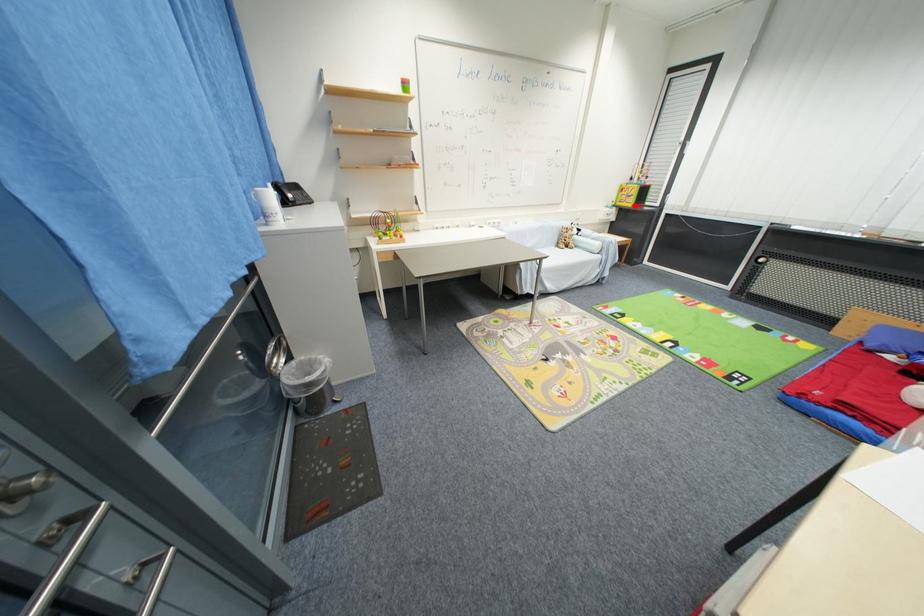
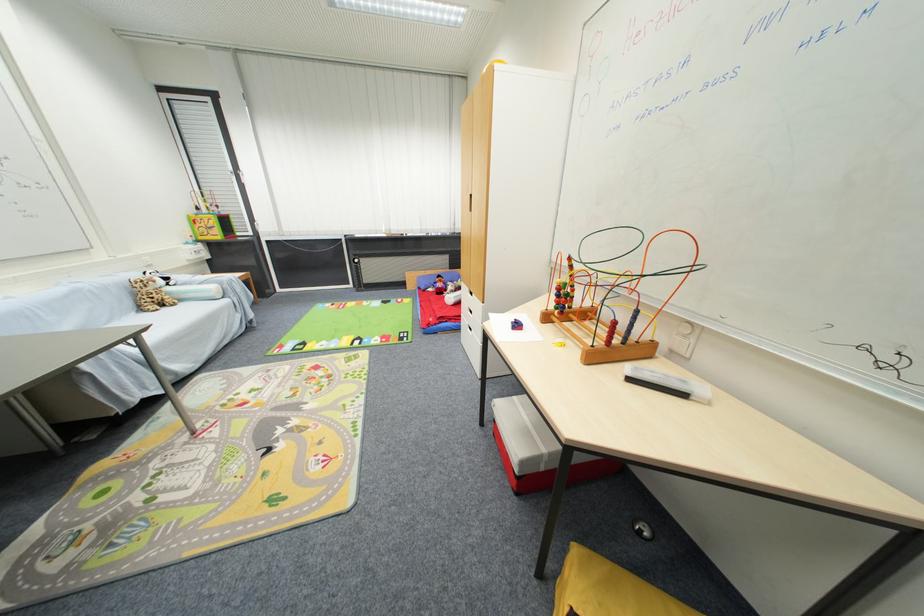
Question: I am providing you with two images of the same scene from different viewpoints. A red point is shown in image1. For the corresponding object point in image2, is it positioned nearer or farther from the camera?

Choices:
 (A) Nearer
 (B) Farther

Answer: (B)